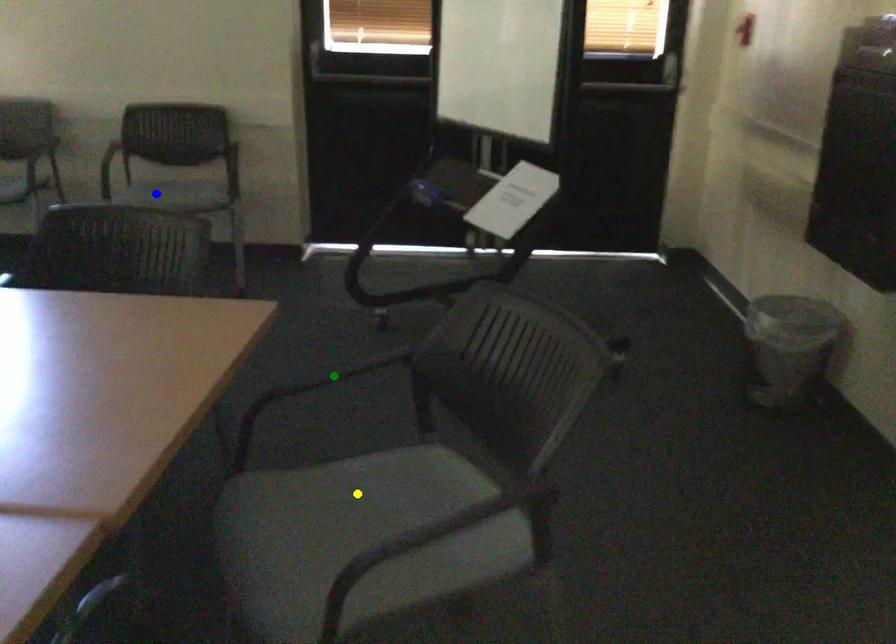
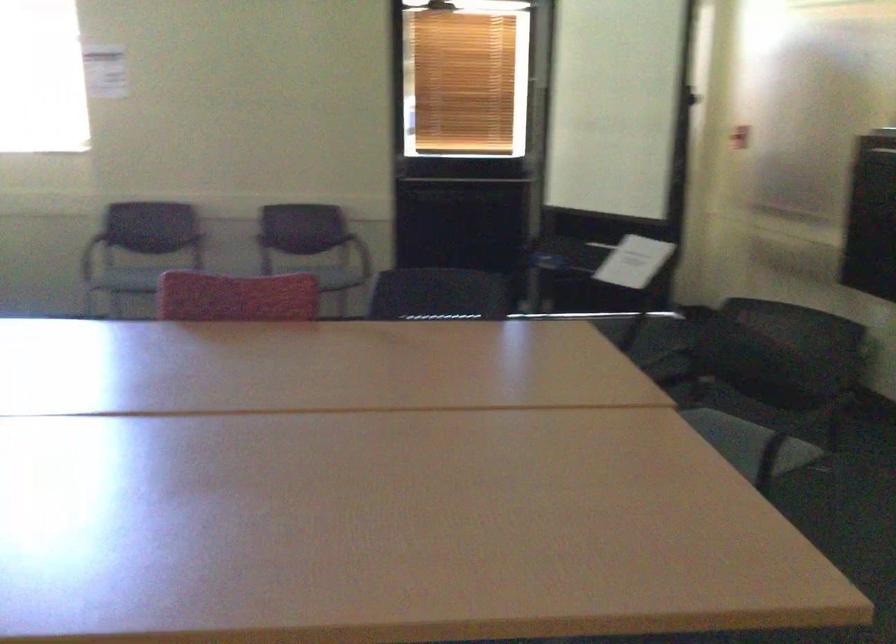
I am providing you with two images of the same scene from different viewpoints. Three points are marked in image1. Which point corresponds to a part or object that is occluded in image2?In image1, three points are marked. Which of them correspond to a part or object that is occluded in image2?Among the three points shown in image1, which one corresponds to a part or object that is no longer visible due to occlusion in image2?

yellow point, green point, blue point cannot be seen in image2.